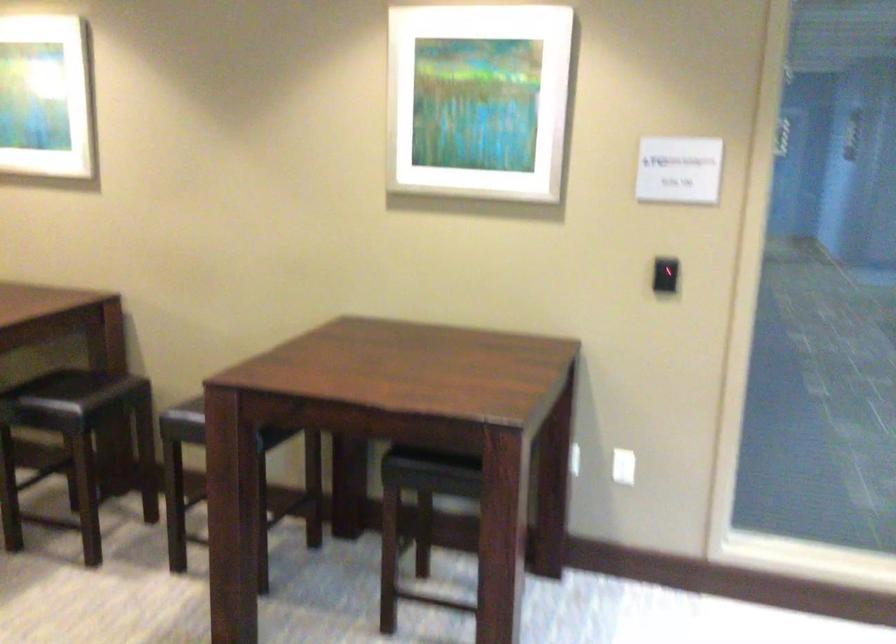
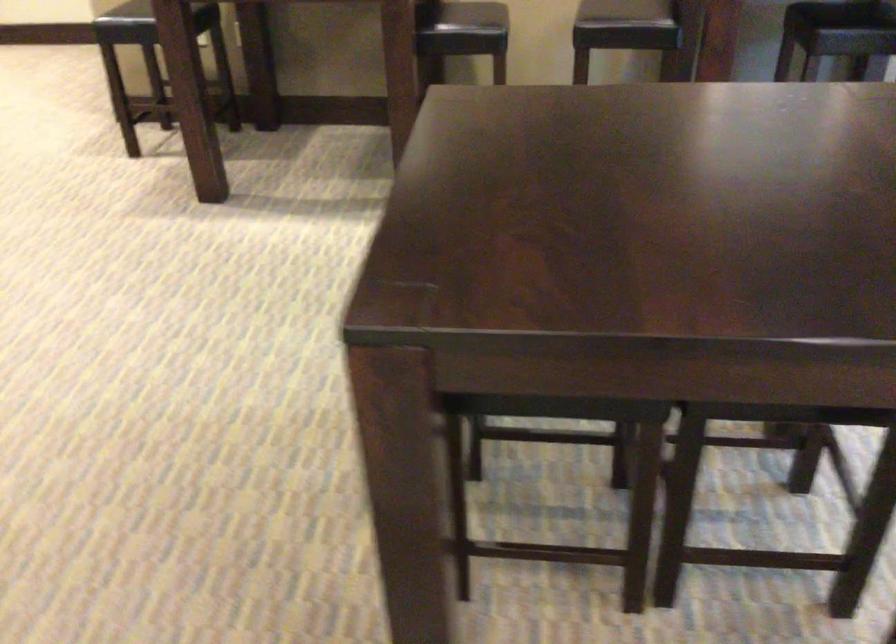
Question: In a continuous first-person perspective shot, in which direction is the camera moving?

Choices:
 (A) Left
 (B) Right
 (C) Forward
 (D) Backward

Answer: (A)